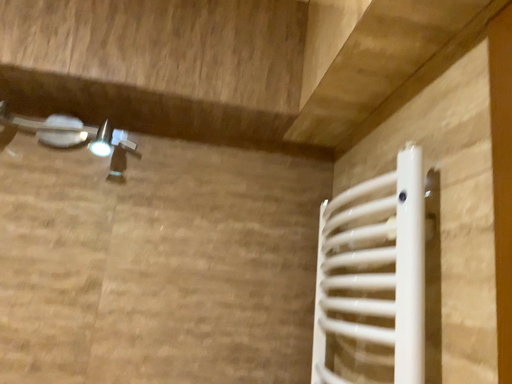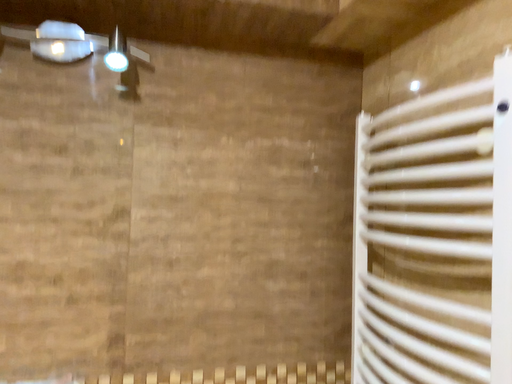
Question: Which way did the camera rotate in the video?

Choices:
 (A) rotated upward
 (B) rotated downward

Answer: (B)